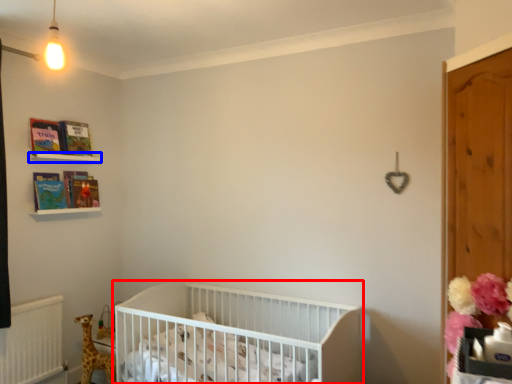
Question: Which point is further to the camera, infant bed (highlighted by a red box) or balustrade (highlighted by a blue box)?

Choices:
 (A) infant bed
 (B) balustrade

Answer: (B)